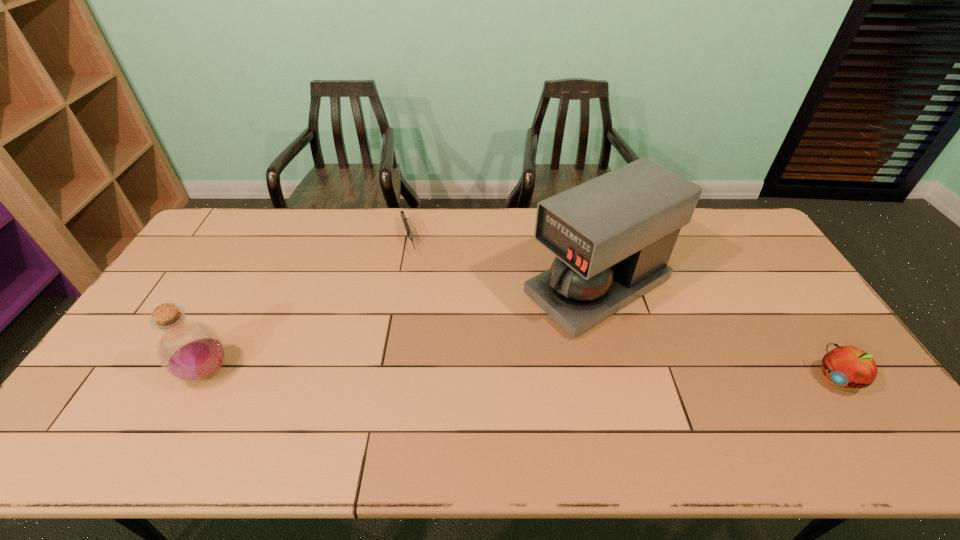
Identify the location of vacant space that is in between the apple and the shortest object. (623, 309).

You are a GUI agent. You are given a task and a screenshot of the screen. Output one action in this format:
    pyautogui.click(x=<x>, y=<y>)
    Task: Click on the vacant space in between the gun and the bottle
    The width and height of the screenshot is (960, 540).
    Given the screenshot: What is the action you would take?
    pos(308,305)

Locate an element on the screen. The height and width of the screenshot is (540, 960). free space between the second object from left to right and the leftmost object is located at coordinates (308, 305).

The width and height of the screenshot is (960, 540). What are the coordinates of `empty space that is in between the shortest object and the bottle` in the screenshot? It's located at (308, 305).

At what (x,y) coordinates should I click in order to perform the action: click on empty location between the tallest object and the second shortest object. Please return your answer as a coordinate pair (x, y). Looking at the image, I should click on (717, 334).

This screenshot has width=960, height=540. Find the location of `empty space between the rightmost object and the bottle`. empty space between the rightmost object and the bottle is located at coordinates pos(522,376).

I want to click on the second closest object to the third object from left to right, so click(x=404, y=219).

Locate an element on the screen. The height and width of the screenshot is (540, 960). object identified as the third closest to the apple is located at coordinates (191, 351).

Locate an element on the screen. This screenshot has height=540, width=960. free space that satisfies the following two spatial constraints: 1. on the back side of the second object from right to left; 2. on the left side of the bottle is located at coordinates (252, 288).

You are a GUI agent. You are given a task and a screenshot of the screen. Output one action in this format:
    pyautogui.click(x=<x>, y=<y>)
    Task: Click on the free space that satisfies the following two spatial constraints: 1. on the back side of the second tallest object; 2. on the left side of the gun
    This screenshot has width=960, height=540.
    Given the screenshot: What is the action you would take?
    pyautogui.click(x=277, y=239)